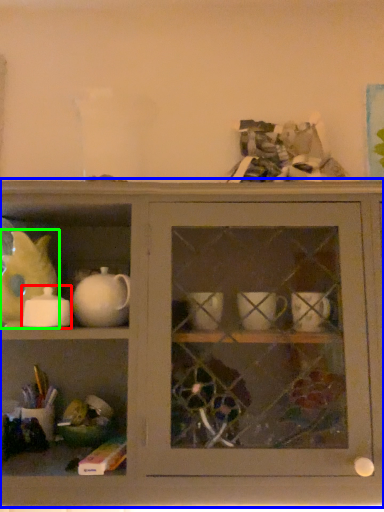
Question: Which object is the farthest from tableware (highlighted by a red box)? Choose among these: shelf (highlighted by a blue box) or animal (highlighted by a green box).

Choices:
 (A) shelf
 (B) animal

Answer: (A)